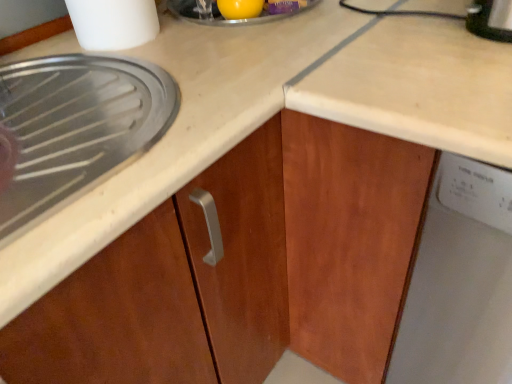
Question: Is white plastic dishwasher at right wider or thinner than yellow rubber ball at upper center?

Choices:
 (A) thin
 (B) wide

Answer: (B)

Question: In the image, is white plastic dishwasher at right positioned in front of or behind yellow rubber ball at upper center?

Choices:
 (A) front
 (B) behind

Answer: (A)

Question: Which object is the farthest from the matte wood cabinet at left?

Choices:
 (A) white plastic dishwasher at right
 (B) white plastic container at upper left
 (C) yellow rubber ball at upper center

Answer: (C)

Question: Based on their relative distances, which object is farther from the yellow rubber ball at upper center?

Choices:
 (A) white plastic container at upper left
 (B) matte wood cabinet at left
 (C) white plastic dishwasher at right

Answer: (C)